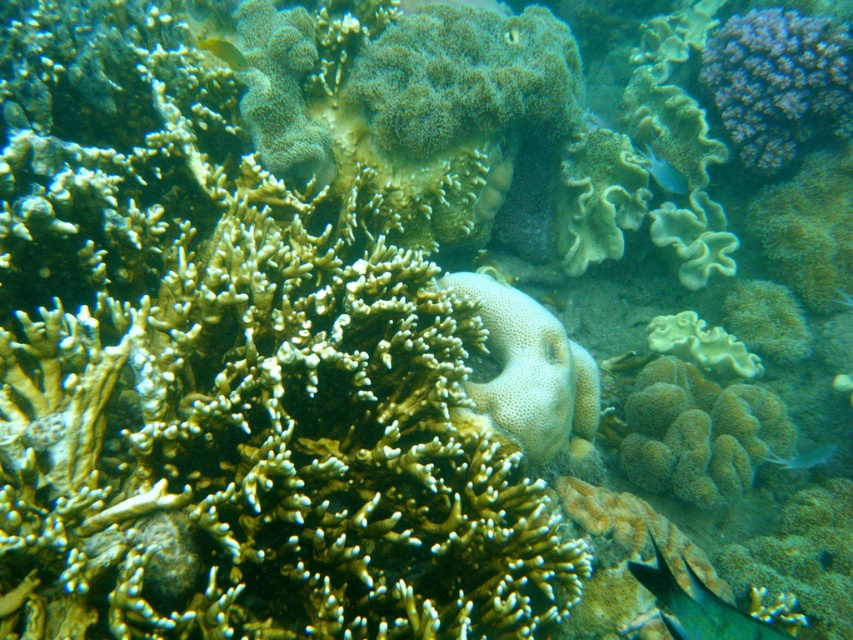
Question: Does green matte fish at lower right appear on the right side of yellow matte fish at upper left?

Choices:
 (A) no
 (B) yes

Answer: (B)

Question: Which object is the farthest from the shiny blue fish at lower right?

Choices:
 (A) purple coral at upper right
 (B) blue glossy fish at upper center

Answer: (A)

Question: Which of the following is the closest to the observer?

Choices:
 (A) green matte fish at lower right
 (B) blue glossy fish at upper center
 (C) shiny blue fish at lower right
 (D) yellow matte fish at upper left

Answer: (A)

Question: Is blue glossy fish at upper center closer to the viewer compared to shiny blue fish at lower right?

Choices:
 (A) no
 (B) yes

Answer: (A)

Question: Is green matte fish at lower right further to the viewer compared to blue glossy fish at upper center?

Choices:
 (A) no
 (B) yes

Answer: (A)

Question: Among these points, which one is nearest to the camera?

Choices:
 (A) (671, 192)
 (B) (791, 148)

Answer: (B)